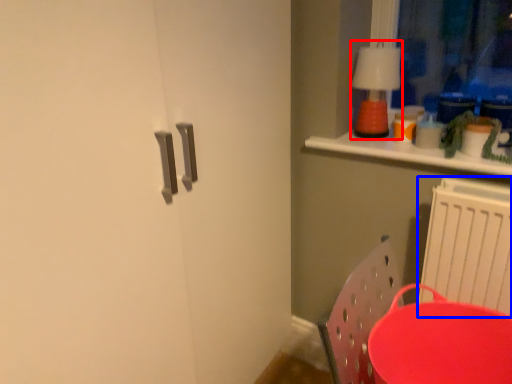
Question: Which object appears farthest to the camera in this image, lamp (highlighted by a red box) or radiator (highlighted by a blue box)?

Choices:
 (A) lamp
 (B) radiator

Answer: (A)